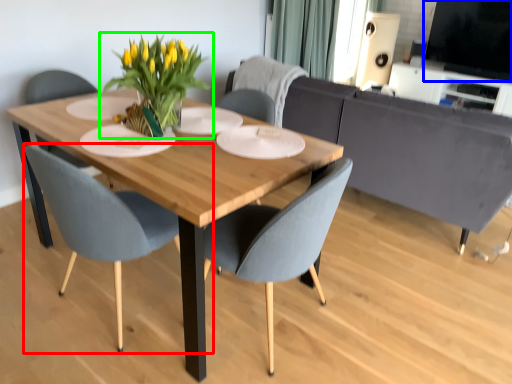
Question: Which object is positioned closest to chair (highlighted by a red box)? Select from window screen (highlighted by a blue box) and houseplant (highlighted by a green box).

Choices:
 (A) window screen
 (B) houseplant

Answer: (B)